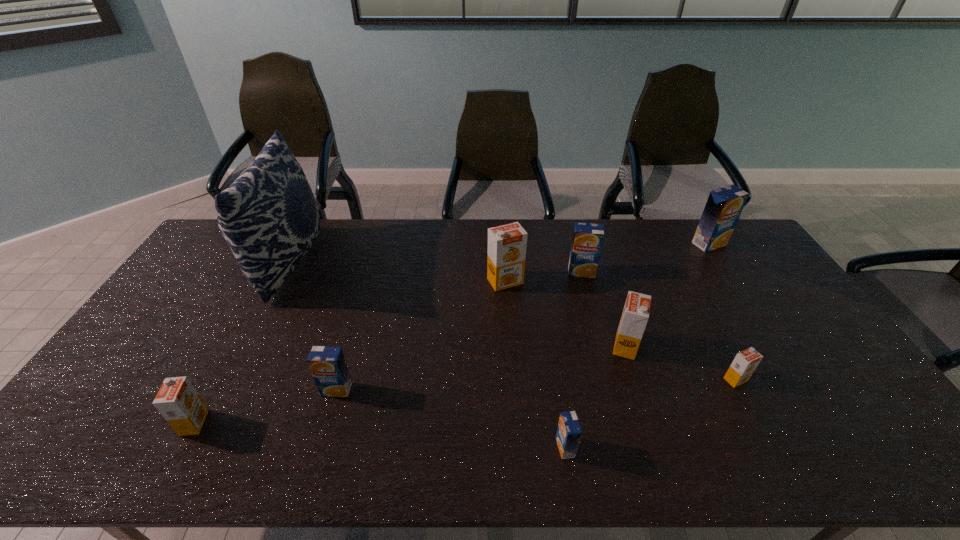
At what (x,y) coordinates should I click in order to perform the action: click on the second nearest blue orange_juice. Please return your answer as a coordinate pair (x, y). Looking at the image, I should click on (327, 364).

You are a GUI agent. You are given a task and a screenshot of the screen. Output one action in this format:
    pyautogui.click(x=<x>, y=<y>)
    Task: Click on the third object from left to right
    
    Given the screenshot: What is the action you would take?
    327,364

Locate an element on the screen. Image resolution: width=960 pixels, height=540 pixels. the third biggest orange orange juice is located at coordinates (178, 402).

Find the location of `the leftmost orange orange juice`. the leftmost orange orange juice is located at coordinates (178, 402).

Find the location of a particular element. the smallest orange orange juice is located at coordinates (744, 364).

This screenshot has width=960, height=540. Identify the location of the second object from right to left. (744, 364).

Where is `the fifth object from left to right`? The height and width of the screenshot is (540, 960). the fifth object from left to right is located at coordinates (569, 432).

The width and height of the screenshot is (960, 540). Find the location of `the nearest blue orange_juice`. the nearest blue orange_juice is located at coordinates (569, 432).

The image size is (960, 540). I want to click on vacant region located 0.350m on the front surface of the tallest object, so click(x=422, y=262).

You are a GUI agent. You are given a task and a screenshot of the screen. Output one action in this format:
    pyautogui.click(x=<x>, y=<y>)
    Task: Click on the free space located 0.170m on the front of the rightmost blue orange_juice
    
    Given the screenshot: What is the action you would take?
    (735, 284)